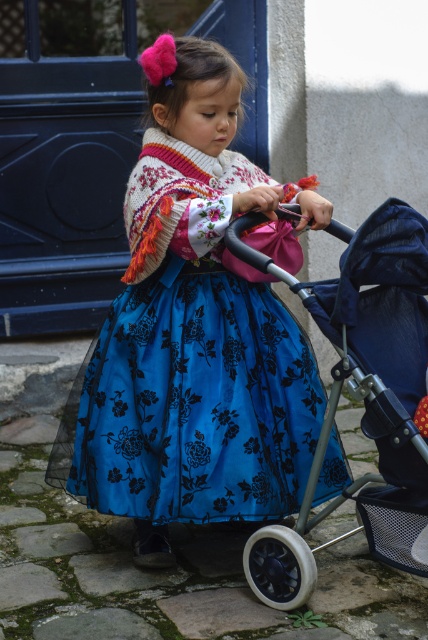
The girl is holding the metallic gray stroller at center. Is the blue satin dress at center closer to her face or farther away?

The blue satin dress at center is further to the viewer than the metallic gray stroller at center, so the dress is farther away from her face.

Based on the photo, you are a photographer setting up a shoot in this scene. You need to position a light to the right of the metallic gray stroller at center. Will the light be to the right or left of the blue satin dress at center?

The blue satin dress at center is to the left of the metallic gray stroller at center. Placing the light to the right of the stroller would mean it is also to the right of the blue satin dress at center.

The girl is holding the handle of the metallic gray stroller at center. Where is the blue satin dress at center in relation to the stroller?

The blue satin dress at center is above the metallic gray stroller at center.